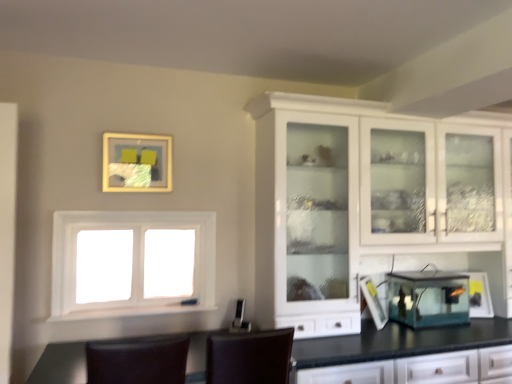
Question: Is transparent glass lantern at lower right, the first appliance in the right-to-left sequence, to the left or to the right of brown leather chair at lower center, the first chair from the left, in the image?

Choices:
 (A) right
 (B) left

Answer: (A)

Question: From a real-world perspective, is transparent glass lantern at lower right, which ranks as the second appliance in left-to-right order, above or below brown leather chair at lower center, the 2th chair when ordered from right to left?

Choices:
 (A) below
 (B) above

Answer: (B)

Question: Which object is positioned closest to the transparent glass lantern at lower right, which ranks as the second appliance in left-to-right order?

Choices:
 (A) white glossy cabinet at upper right
 (B) brown leather chair at lower center, the first chair from the left
 (C) brown leather chair at center, which is counted as the first chair, starting from the right
 (D) white matte window at center
 (E) matte gold picture frame at upper center

Answer: (A)

Question: Which of these objects is positioned farthest from the transparent glass lantern at lower right, which ranks as the second appliance in left-to-right order?

Choices:
 (A) brown leather chair at center, which is counted as the first chair, starting from the right
 (B) brown leather chair at lower center, the first chair from the left
 (C) matte gold picture frame at upper center
 (D) white matte window at center
 (E) white glossy cabinet at upper right

Answer: (C)